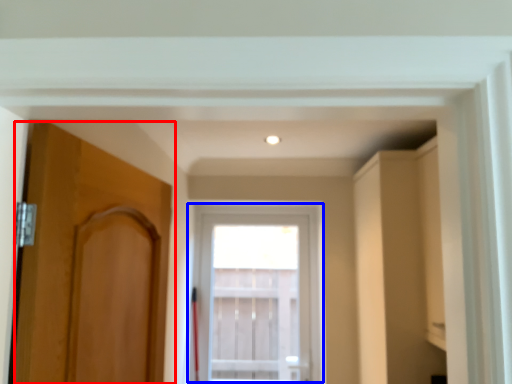
Question: Which object is closer to the camera taking this photo, door (highlighted by a red box) or window (highlighted by a blue box)?

Choices:
 (A) door
 (B) window

Answer: (A)